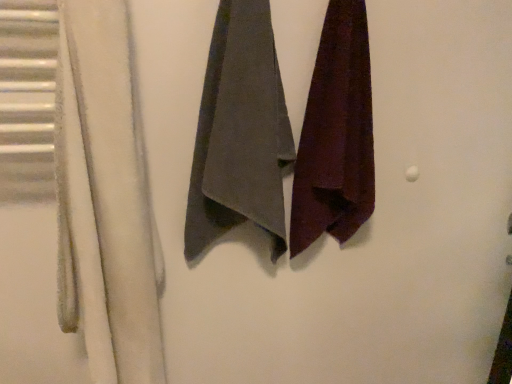
Question: From a real-world perspective, relative to velvet maroon towel at right, positioned as the first towel in right-to-left order, is white fuzzy towel at left vertically above or below?

Choices:
 (A) above
 (B) below

Answer: (B)

Question: Looking at their shapes, would you say white fuzzy towel at left is wider or thinner than velvet maroon towel at right, positioned as the first towel in right-to-left order?

Choices:
 (A) thin
 (B) wide

Answer: (B)

Question: Based on their relative distances, which object is farther from the white fuzzy towel at left?

Choices:
 (A) gray cotton towel at center, the 2th towel viewed from the right
 (B) velvet maroon towel at right, acting as the second towel starting from the left

Answer: (B)

Question: Based on their relative distances, which object is farther from the velvet maroon towel at right, positioned as the first towel in right-to-left order?

Choices:
 (A) white fuzzy towel at left
 (B) gray cotton towel at center, the 2th towel viewed from the right

Answer: (A)